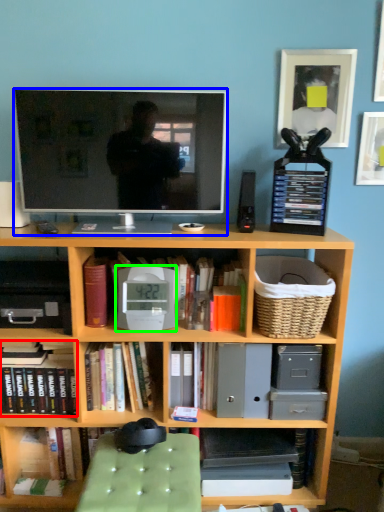
Question: Which object is the closest to the book (highlighted by a red box)? Choose among these: television (highlighted by a blue box) or alarm clock (highlighted by a green box).

Choices:
 (A) television
 (B) alarm clock

Answer: (B)